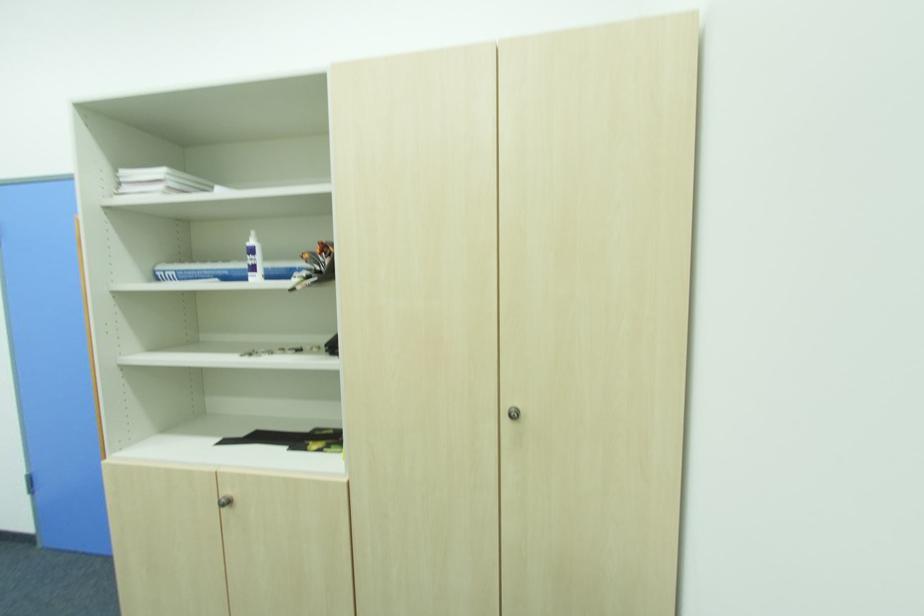
The width and height of the screenshot is (924, 616). Find the location of `stack of white books`. stack of white books is located at coordinates (159, 180).